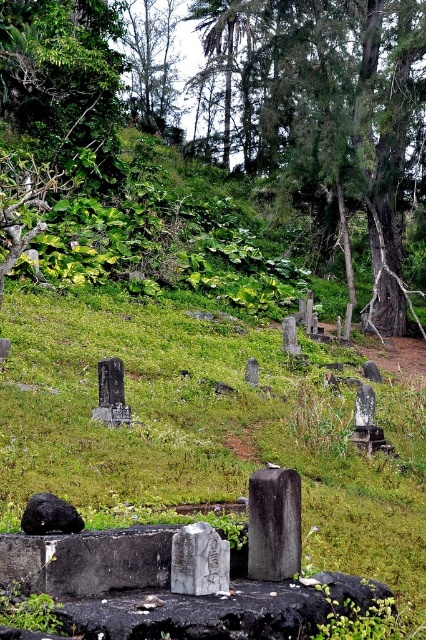
Who is higher up, green leafy tree at upper center or black polished stone gravestone at center?

green leafy tree at upper center is higher up.

Who is shorter, green leafy tree at upper center or black polished stone gravestone at center?

black polished stone gravestone at center

Which is behind, point (402, 150) or point (294, 529)?

The point (402, 150) is behind.

I want to click on green leafy tree at upper center, so click(x=333, y=116).

Can you confirm if green leafy tree at upper center is smaller than white marble gravestone at center?

No.

The width and height of the screenshot is (426, 640). What are the coordinates of `green leafy tree at upper center` in the screenshot? It's located at (333, 116).

In order to click on green grassy at center in this screenshot , I will do `click(207, 428)`.